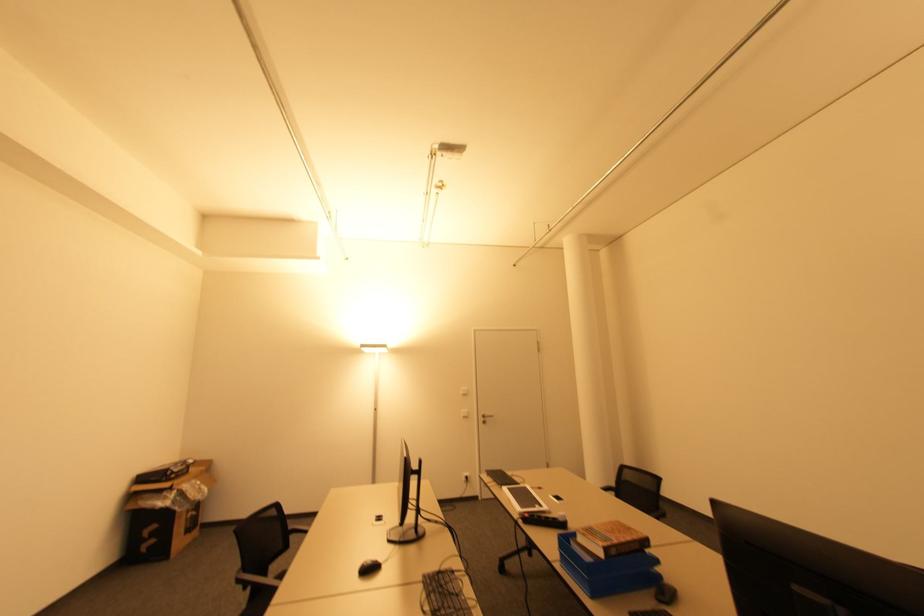
Which object does [624,573] point to?

It refers to a blue paper tray.